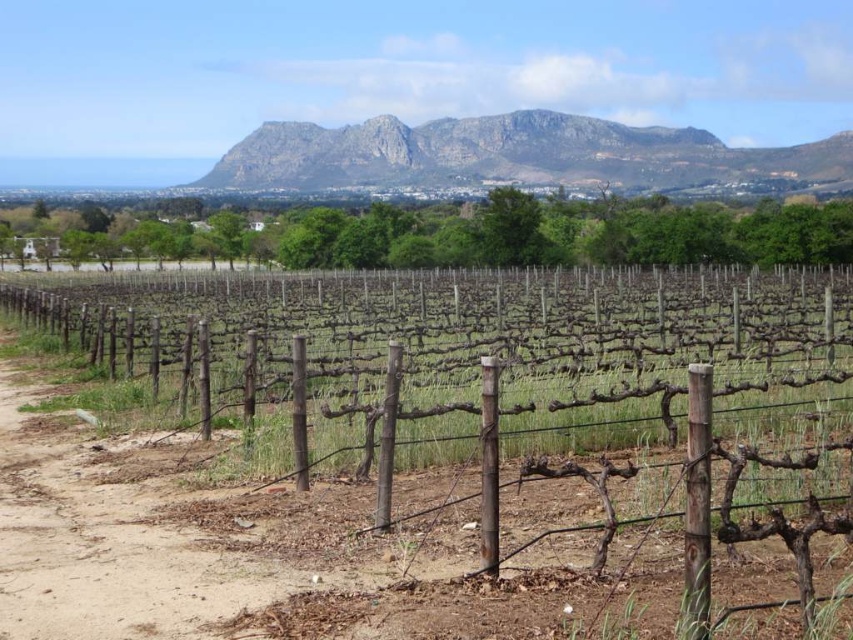
Question: Can you confirm if brown wooden fence at center is bigger than rugged stone mountain at upper center?

Choices:
 (A) no
 (B) yes

Answer: (B)

Question: Which object is closer to the camera taking this photo?

Choices:
 (A) rugged stone mountain at upper center
 (B) brown wooden fence at center

Answer: (B)

Question: Which point is farther to the camera?

Choices:
 (A) rugged stone mountain at upper center
 (B) brown wooden fence at center

Answer: (A)

Question: Does brown wooden fence at center have a lesser width compared to rugged stone mountain at upper center?

Choices:
 (A) no
 (B) yes

Answer: (B)

Question: Does brown wooden fence at center appear over rugged stone mountain at upper center?

Choices:
 (A) no
 (B) yes

Answer: (A)